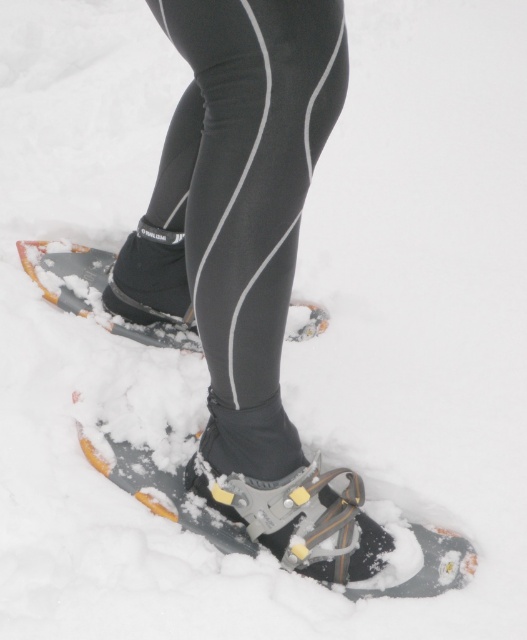
Which is more to the right, gray rubber snowshoe at lower center or black rubber snowshoe at lower center?

gray rubber snowshoe at lower center

Between gray rubber snowshoe at lower center and black rubber snowshoe at lower center, which one appears on the left side from the viewer's perspective?

From the viewer's perspective, black rubber snowshoe at lower center appears more on the left side.

Between point (446, 577) and point (288, 337), which one is positioned behind?

Positioned behind is point (288, 337).

You are a GUI agent. You are given a task and a screenshot of the screen. Output one action in this format:
    pyautogui.click(x=<x>, y=<y>)
    Task: Click on the gray rubber snowshoe at lower center
    This screenshot has width=527, height=640.
    Given the screenshot: What is the action you would take?
    pyautogui.click(x=163, y=493)

From the picture: Does black/stretchy fabric leggings at center have a larger size compared to black rubber snowshoe at lower center?

Correct, black/stretchy fabric leggings at center is larger in size than black rubber snowshoe at lower center.

Image resolution: width=527 pixels, height=640 pixels. Describe the element at coordinates (245, 198) in the screenshot. I see `black/stretchy fabric leggings at center` at that location.

Identify the location of black/stretchy fabric leggings at center. (245, 198).

Can you confirm if black/stretchy fabric leggings at center is positioned to the left of gray rubber snowshoe at lower center?

Incorrect, black/stretchy fabric leggings at center is not on the left side of gray rubber snowshoe at lower center.

Does black/stretchy fabric leggings at center have a smaller size compared to gray rubber snowshoe at lower center?

Incorrect, black/stretchy fabric leggings at center is not smaller in size than gray rubber snowshoe at lower center.

Which is behind, point (274, 204) or point (222, 524)?

Point (222, 524)

Where is `black/stretchy fabric leggings at center`? black/stretchy fabric leggings at center is located at coordinates (245, 198).